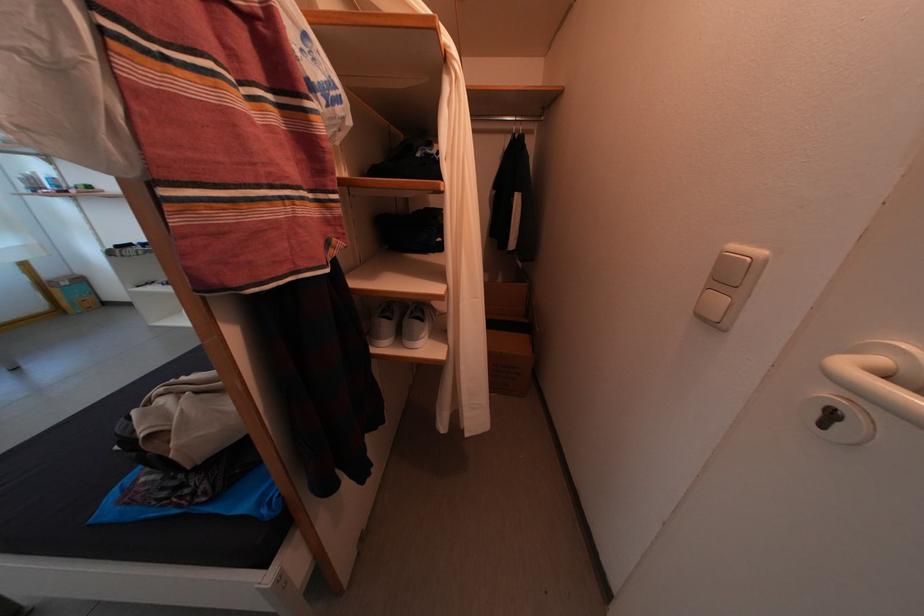
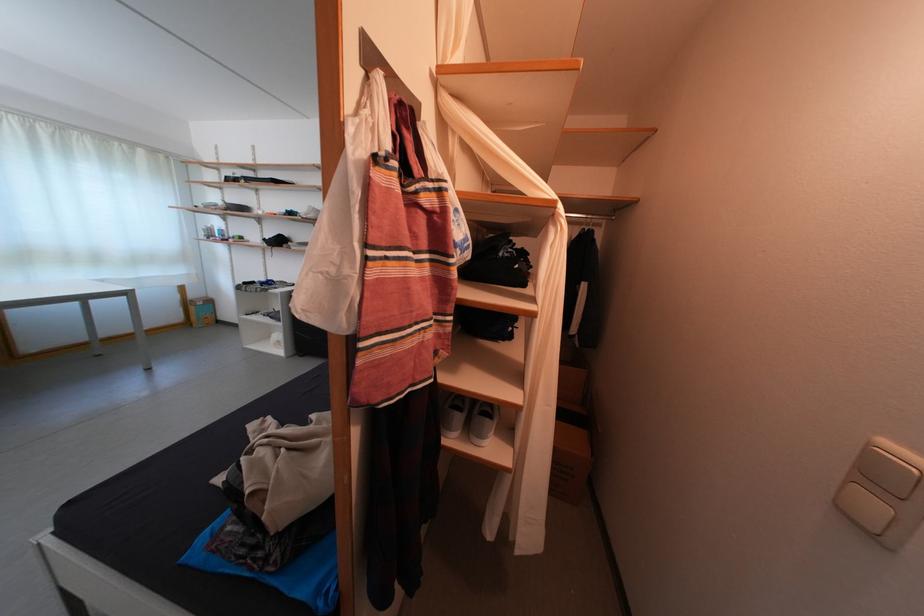
Where in the second image is the point corresponding to the point at 744,251 from the first image?

(894, 448)